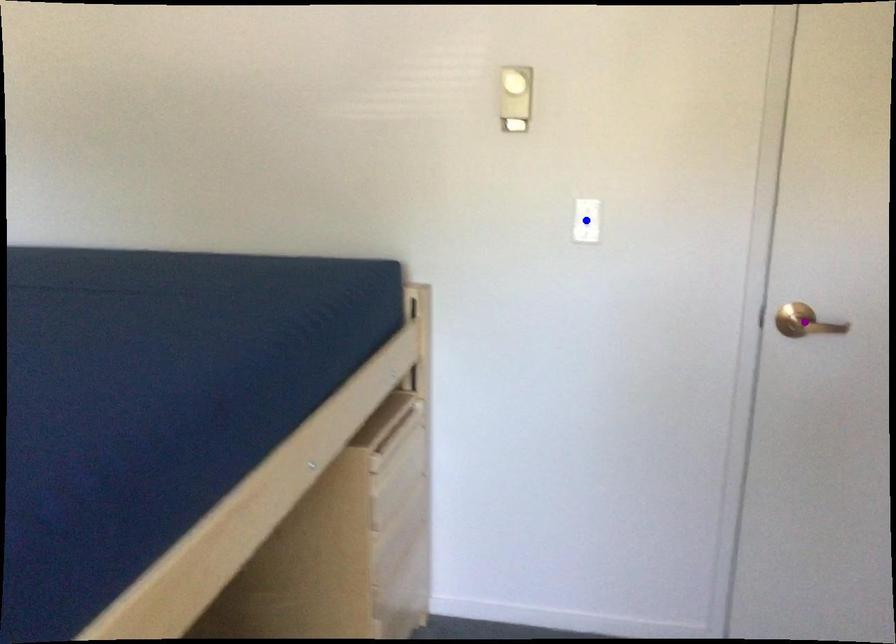
Looking at this image, order these from nearest to farthest:
purple point
orange point
blue point

purple point < orange point < blue point